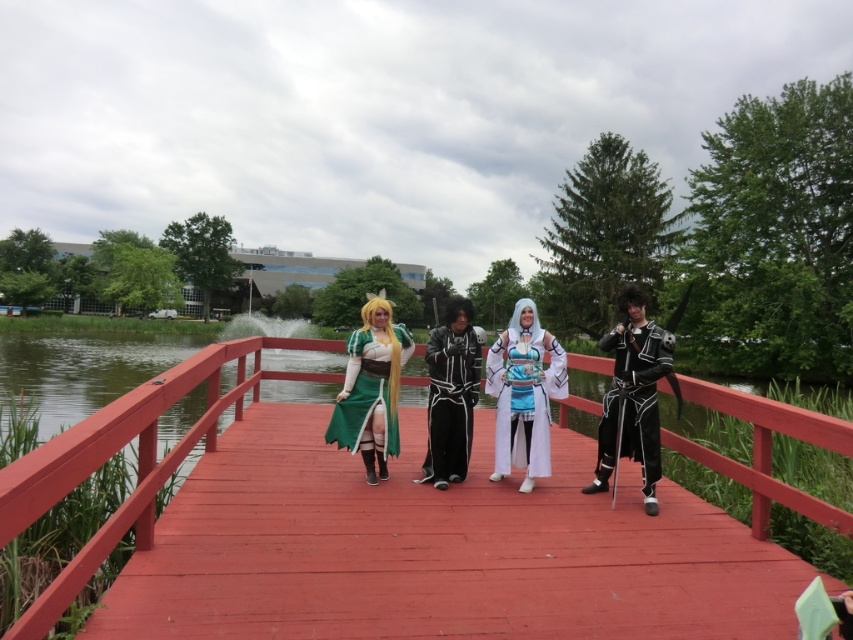
You are a photographer trying to capture the group of people on the red wooden bridge. You notice the black satin robe at center and the green satin dress at center. Which one is more to the left?

The green satin dress at center is more to the left because the black satin robe at center is positioned on the right side of it.

You are standing on the wooden bridge at center and want to hand a scroll to the person wearing the black satin robe at center. In which direction should you move to reach them?

The black satin robe at center is to the right of the wooden bridge at center, so you should move to your right to reach them.

Where is the wooden bridge at center located in the image?

The wooden bridge at center is located at point (148, 458) in the image.